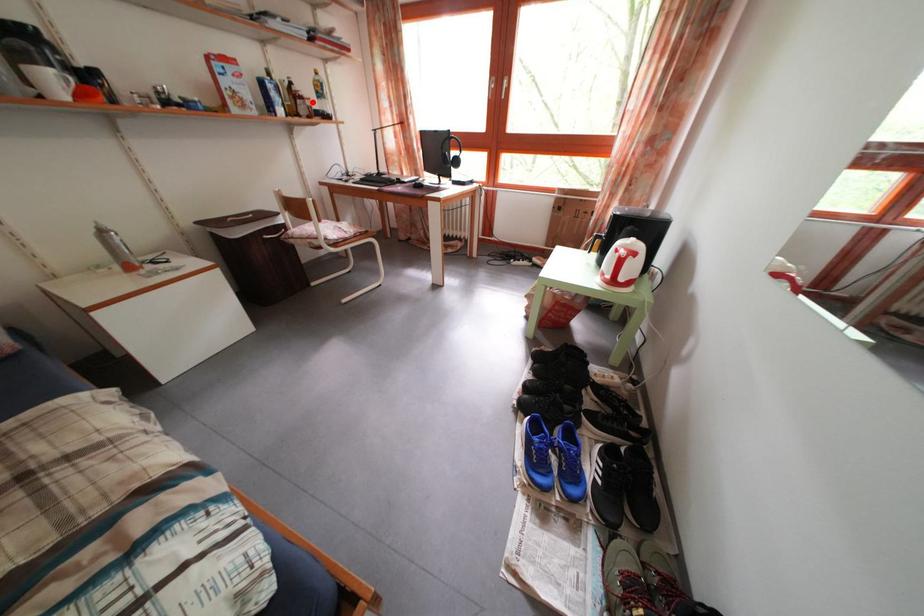
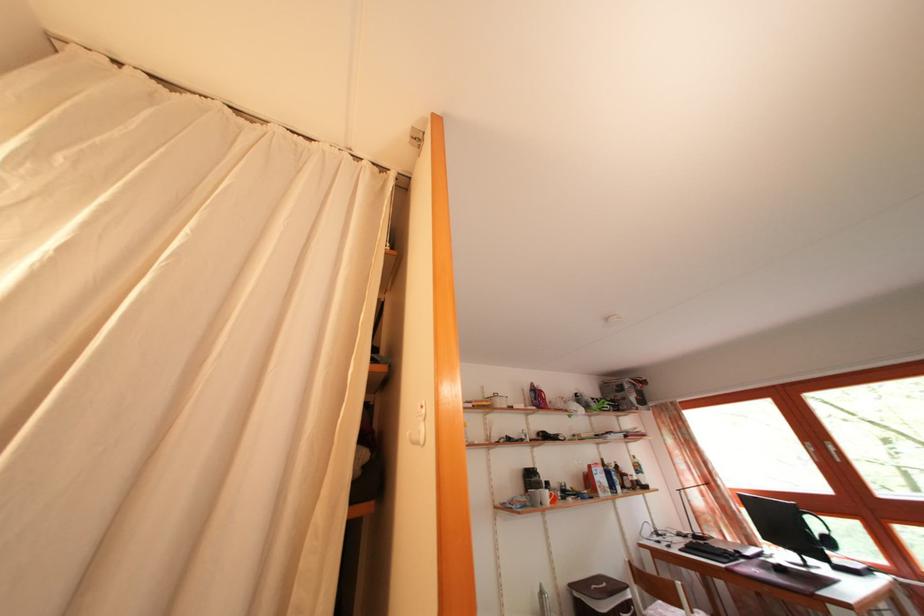
In the second image, find the point that corresponds to the highlighted location in the first image.

(636, 480)